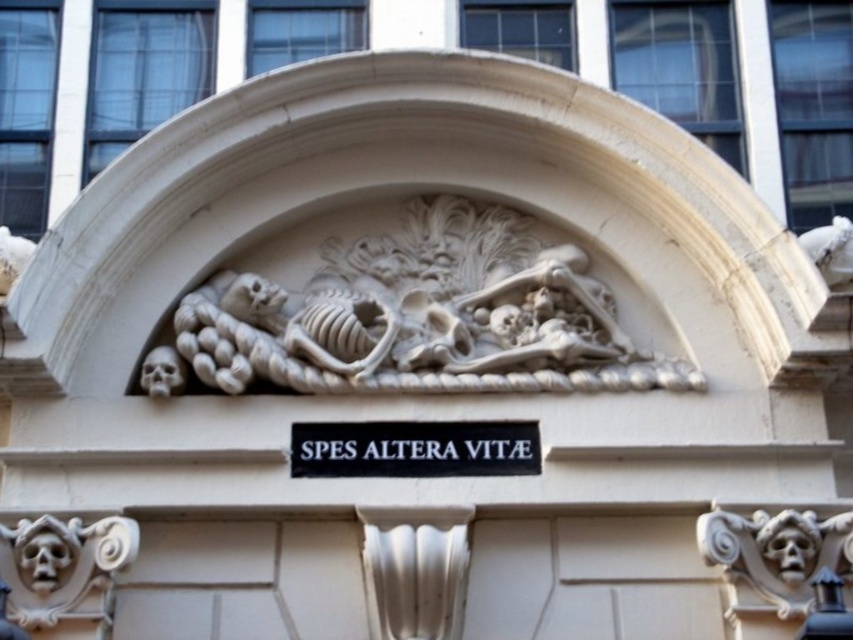
Between white stone skeleton at center and black matte sign at center, which one is positioned higher?

white stone skeleton at center is higher up.

In the scene shown: Which of these two, white stone skeleton at center or black matte sign at center, stands shorter?

black matte sign at center

Where is `white stone skeleton at center`? white stone skeleton at center is located at coordinates (416, 317).

Where is `white stone skeleton at center`? The height and width of the screenshot is (640, 853). white stone skeleton at center is located at coordinates (416, 317).